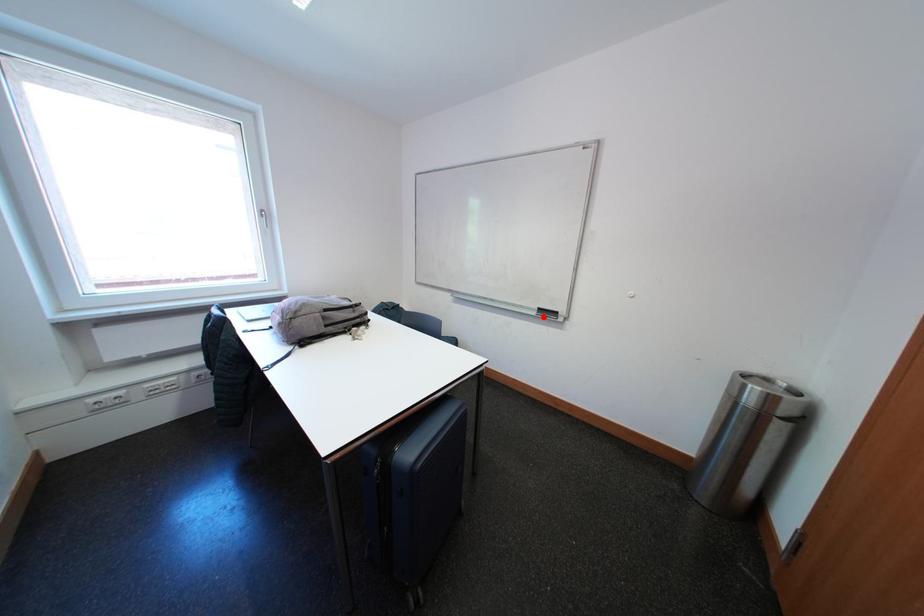
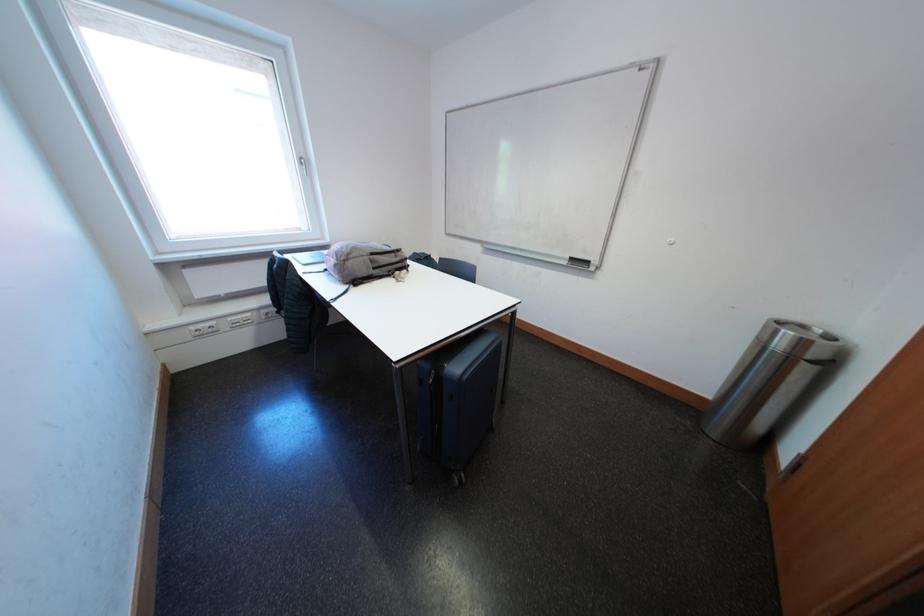
Locate, in the second image, the point that corresponds to the highlighted location in the first image.

(575, 267)